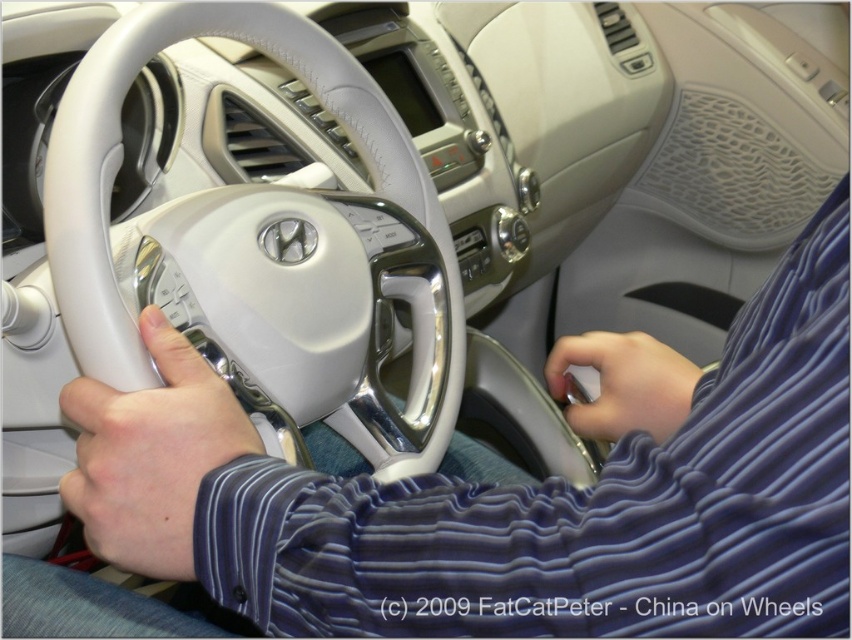
Can you confirm if white leather steering wheel at center is shorter than satin blue sleeve at lower right?

No, white leather steering wheel at center is not shorter than satin blue sleeve at lower right.

Who is lower down, white leather steering wheel at center or satin blue sleeve at lower right?

satin blue sleeve at lower right is below.

Identify the location of white leather steering wheel at center. This screenshot has width=852, height=640. (265, 250).

Who is more distant from viewer, (98, 449) or (626, 406)?

The point (626, 406) is more distant.

The image size is (852, 640). What do you see at coordinates (150, 456) in the screenshot? I see `matte white steering wheel at center` at bounding box center [150, 456].

This screenshot has height=640, width=852. Describe the element at coordinates (150, 456) in the screenshot. I see `matte white steering wheel at center` at that location.

In order to click on matte white steering wheel at center in this screenshot , I will do `click(150, 456)`.

Is white leather shirt at center positioned before white leather steering wheel at center?

Yes, white leather shirt at center is closer to the viewer.

Does white leather shirt at center have a lesser height compared to white leather steering wheel at center?

Indeed, white leather shirt at center has a lesser height compared to white leather steering wheel at center.

Is point (812, 438) less distant than point (360, 346)?

That is True.

The image size is (852, 640). What are the coordinates of `white leather shirt at center` in the screenshot? It's located at (509, 500).